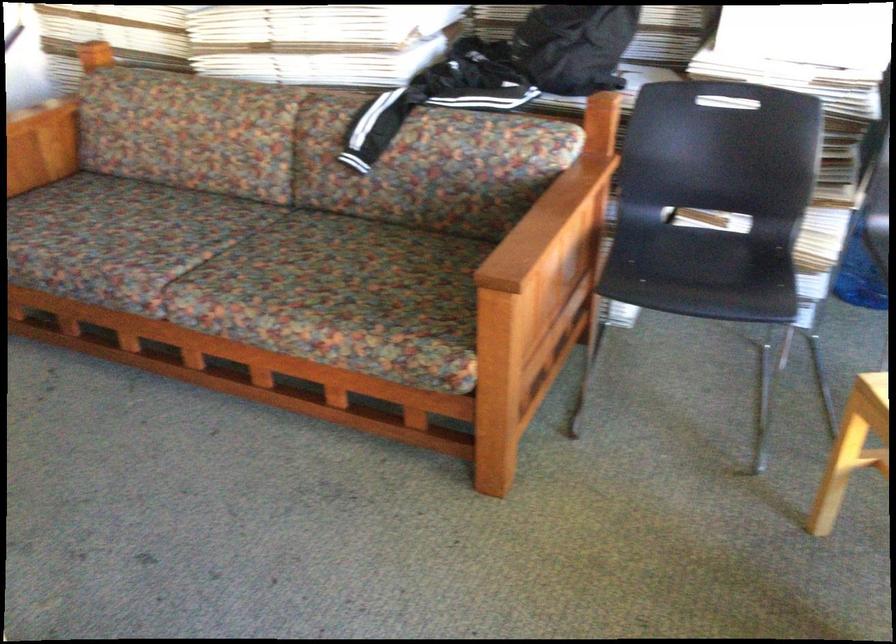
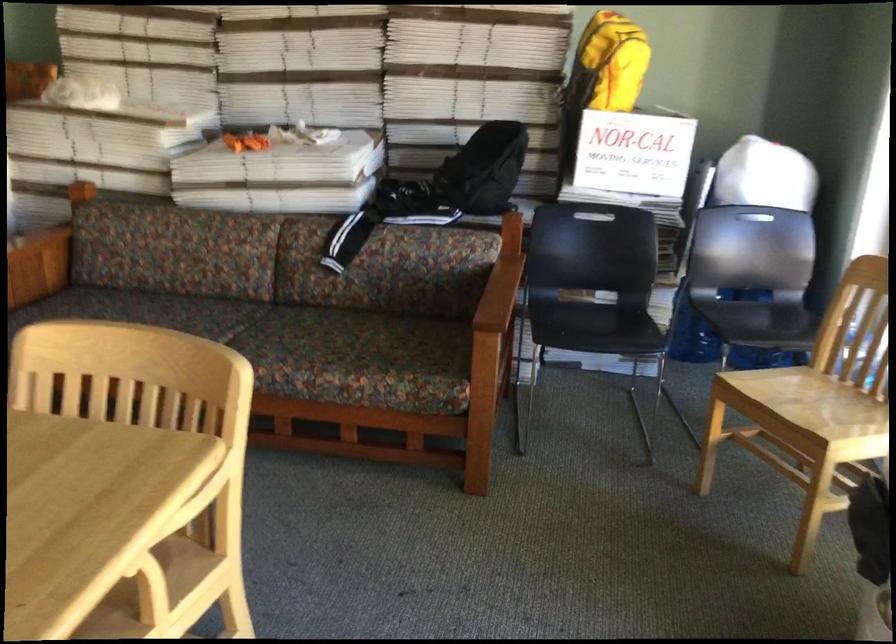
Question: How did the camera likely rotate?

Choices:
 (A) Left
 (B) Right
 (C) Up
 (D) Down

Answer: (B)